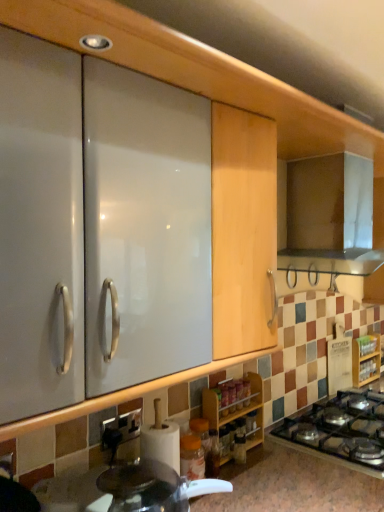
At what (x,y) coordinates should I click in order to perform the action: click on wooden spice rack at lower center, arranged as the first cabinetry when viewed from the front. Please return your answer as a coordinate pair (x, y). Looking at the image, I should click on (235, 413).

Could you measure the distance between white glossy countertop at lower center and metallic silver range hood at upper right?

white glossy countertop at lower center and metallic silver range hood at upper right are 37.92 inches apart.

In terms of width, does white glossy countertop at lower center look wider or thinner when compared to metallic silver range hood at upper right?

In the image, white glossy countertop at lower center appears to be more narrow than metallic silver range hood at upper right.

From the picture: Considering the relative positions of white glossy countertop at lower center and metallic silver range hood at upper right in the image provided, is white glossy countertop at lower center behind metallic silver range hood at upper right?

That is False.

Considering the relative sizes of white glossy countertop at lower center and metallic silver range hood at upper right in the image provided, is white glossy countertop at lower center bigger than metallic silver range hood at upper right?

No.

In the image, is wooden spice rack at lower center, arranged as the first cabinetry when viewed from the front, on the left side or the right side of white glossy countertop at lower center?

Based on their positions, wooden spice rack at lower center, arranged as the first cabinetry when viewed from the front, is located to the right of white glossy countertop at lower center.

Is wooden spice rack at lower center, which is the second cabinetry from right to left, in front of or behind white glossy countertop at lower center in the image?

In the image, wooden spice rack at lower center, which is the second cabinetry from right to left, appears behind white glossy countertop at lower center.

Between wooden spice rack at lower center, arranged as the first cabinetry when viewed from the front, and white glossy countertop at lower center, which one has smaller width?

wooden spice rack at lower center, arranged as the first cabinetry when viewed from the front, is thinner.

From the image's perspective, does white glossy countertop at lower center appear higher than black glass gas stove at lower right?

Yes, from the image's perspective, white glossy countertop at lower center is on top of black glass gas stove at lower right.

Which object is thinner, white glossy countertop at lower center or black glass gas stove at lower right?

With smaller width is white glossy countertop at lower center.

Looking at this image, which object is further away from the camera, white glossy countertop at lower center or black glass gas stove at lower right?

black glass gas stove at lower right is more distant.

From a real-world perspective, is white glossy countertop at lower center positioned over black glass gas stove at lower right based on gravity?

Indeed, from a real-world perspective, white glossy countertop at lower center stands above black glass gas stove at lower right.

Is point (376, 344) closer or farther from the camera than point (324, 426)?

Point (376, 344) is positioned farther from the camera compared to point (324, 426).

In terms of size, does wooden spice rack at lower right, which is the 1th cabinetry in back-to-front order, appear bigger or smaller than black glass gas stove at lower right?

Considering their sizes, wooden spice rack at lower right, which is the 1th cabinetry in back-to-front order, takes up less space than black glass gas stove at lower right.

From their relative heights in the image, would you say wooden spice rack at lower right, which appears as the 1th cabinetry when viewed from the right, is taller or shorter than black glass gas stove at lower right?

Clearly, wooden spice rack at lower right, which appears as the 1th cabinetry when viewed from the right, is taller compared to black glass gas stove at lower right.

Between wooden spice rack at lower right, which is the 1th cabinetry in back-to-front order, and black glass gas stove at lower right, which one has larger width?

Wider between the two is black glass gas stove at lower right.

Would you say white glossy countertop at lower center is a long distance from wooden spice rack at lower right, which is the 2th cabinetry from front to back?

Yes, white glossy countertop at lower center and wooden spice rack at lower right, which is the 2th cabinetry from front to back, are located far from each other.

Is wooden spice rack at lower right, which is the 2th cabinetry from front to back, surrounded by white glossy countertop at lower center?

No, wooden spice rack at lower right, which is the 2th cabinetry from front to back, is not inside white glossy countertop at lower center.

From the image's perspective, which one is positioned higher, white glossy countertop at lower center or wooden spice rack at lower right, which appears as the 1th cabinetry when viewed from the right?

wooden spice rack at lower right, which appears as the 1th cabinetry when viewed from the right, is shown above in the image.

From the picture: From their relative heights in the image, would you say white glossy countertop at lower center is taller or shorter than wooden spice rack at lower right, which is the 1th cabinetry in back-to-front order?

white glossy countertop at lower center is shorter than wooden spice rack at lower right, which is the 1th cabinetry in back-to-front order.

Would you consider wooden spice rack at lower right, which is the 2th cabinetry from front to back, to be distant from white glossy countertop at lower center?

wooden spice rack at lower right, which is the 2th cabinetry from front to back, is far away from white glossy countertop at lower center.

From a real-world perspective, is wooden spice rack at lower right, which is the 2th cabinetry from front to back, below white glossy countertop at lower center?

No, from a real-world perspective, wooden spice rack at lower right, which is the 2th cabinetry from front to back, is not under white glossy countertop at lower center.

Is wooden spice rack at lower right, which appears as the 1th cabinetry when viewed from the right, in front of white glossy countertop at lower center?

No, wooden spice rack at lower right, which appears as the 1th cabinetry when viewed from the right, is behind white glossy countertop at lower center.

Is wooden spice rack at lower right, which appears as the 1th cabinetry when viewed from the right, bigger than white glossy countertop at lower center?

No, wooden spice rack at lower right, which appears as the 1th cabinetry when viewed from the right, is not bigger than white glossy countertop at lower center.

Is metallic silver range hood at upper right further to camera compared to wooden spice rack at lower right, which appears as the 2th cabinetry when viewed from the left?

No, it is in front of wooden spice rack at lower right, which appears as the 2th cabinetry when viewed from the left.

Which object is thinner, metallic silver range hood at upper right or wooden spice rack at lower right, which is the 2th cabinetry from front to back?

wooden spice rack at lower right, which is the 2th cabinetry from front to back, is thinner.

Looking at this image, from the image's perspective, which one is positioned higher, metallic silver range hood at upper right or wooden spice rack at lower right, which appears as the 2th cabinetry when viewed from the left?

From the image's view, metallic silver range hood at upper right is above.

Is metallic silver range hood at upper right next to wooden spice rack at lower right, which appears as the 2th cabinetry when viewed from the left?

metallic silver range hood at upper right is not next to wooden spice rack at lower right, which appears as the 2th cabinetry when viewed from the left, and they're not touching.

Where is `home appliance positioned vertically above the white glossy countertop at lower center (from a real-world perspective)`? home appliance positioned vertically above the white glossy countertop at lower center (from a real-world perspective) is located at coordinates (330, 216).

The height and width of the screenshot is (512, 384). Find the location of `countertop in front of the wooden spice rack at lower center, arranged as the first cabinetry when viewed from the front`. countertop in front of the wooden spice rack at lower center, arranged as the first cabinetry when viewed from the front is located at coordinates (293, 484).

In the scene shown: From the image, which object appears to be nearer to wooden spice rack at lower center, marked as the 2th cabinetry in a back-to-front arrangement, white glossy countertop at lower center or wooden spice rack at lower right, which appears as the 1th cabinetry when viewed from the right?

white glossy countertop at lower center is positioned closer to the anchor wooden spice rack at lower center, marked as the 2th cabinetry in a back-to-front arrangement.

Based on their spatial positions, is black glass gas stove at lower right or metallic silver range hood at upper right closer to wooden spice rack at lower right, which appears as the 2th cabinetry when viewed from the left?

black glass gas stove at lower right.

Looking at this image, estimate the real-world distances between objects in this image. Which object is closer to white glossy countertop at lower center, black glass gas stove at lower right or wooden spice rack at lower center, which is the second cabinetry from right to left?

wooden spice rack at lower center, which is the second cabinetry from right to left, lies closer to white glossy countertop at lower center than the other object.

Based on their spatial positions, is white glossy countertop at lower center or metallic silver range hood at upper right closer to black glass gas stove at lower right?

white glossy countertop at lower center is closer to black glass gas stove at lower right.

Looking at the image, which one is located closer to wooden spice rack at lower center, the first cabinetry positioned from the left, black glass gas stove at lower right or metallic silver range hood at upper right?

black glass gas stove at lower right is closer to wooden spice rack at lower center, the first cabinetry positioned from the left.

Estimate the real-world distances between objects in this image. Which object is closer to wooden spice rack at lower right, which appears as the 1th cabinetry when viewed from the right, white glossy countertop at lower center or wooden spice rack at lower center, arranged as the first cabinetry when viewed from the front?

wooden spice rack at lower center, arranged as the first cabinetry when viewed from the front.

Looking at the image, which one is located further to wooden spice rack at lower right, which appears as the 1th cabinetry when viewed from the right, wooden spice rack at lower center, which is the second cabinetry from right to left, or black glass gas stove at lower right?

wooden spice rack at lower center, which is the second cabinetry from right to left, lies further to wooden spice rack at lower right, which appears as the 1th cabinetry when viewed from the right, than the other object.

Estimate the real-world distances between objects in this image. Which object is further from metallic silver range hood at upper right, wooden spice rack at lower right, which appears as the 1th cabinetry when viewed from the right, or wooden spice rack at lower center, the first cabinetry positioned from the left?

wooden spice rack at lower right, which appears as the 1th cabinetry when viewed from the right, is positioned further to the anchor metallic silver range hood at upper right.

Image resolution: width=384 pixels, height=512 pixels. What are the coordinates of `gas stove between white glossy countertop at lower center and wooden spice rack at lower right, which appears as the 1th cabinetry when viewed from the right, in the front-back direction` in the screenshot? It's located at (341, 429).

You are a GUI agent. You are given a task and a screenshot of the screen. Output one action in this format:
    pyautogui.click(x=<x>, y=<y>)
    Task: Click on the countertop between metallic silver range hood at upper right and black glass gas stove at lower right in the up-down direction
    The image size is (384, 512).
    Given the screenshot: What is the action you would take?
    pyautogui.click(x=293, y=484)

I want to click on home appliance between white glossy countertop at lower center and wooden spice rack at lower right, which is the 1th cabinetry in back-to-front order, in the front-back direction, so (x=330, y=216).

Image resolution: width=384 pixels, height=512 pixels. I want to click on cabinetry situated between white glossy countertop at lower center and black glass gas stove at lower right from left to right, so 235,413.